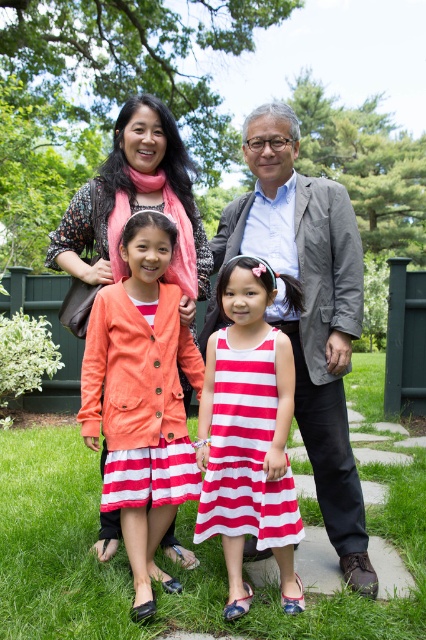
Between matte coral jacket at center and coral fabric jacket at center, which one is positioned higher?

matte coral jacket at center is higher up.

Can you confirm if matte coral jacket at center is smaller than coral fabric jacket at center?

Actually, matte coral jacket at center might be larger than coral fabric jacket at center.

Who is more distant from viewer, (256, 157) or (172, 476)?

The point (256, 157) is behind.

The height and width of the screenshot is (640, 426). Find the location of `matte coral jacket at center`. matte coral jacket at center is located at coordinates (308, 310).

Is matte coral jacket at center smaller than striped cotton dress at center?

No, matte coral jacket at center is not smaller than striped cotton dress at center.

This screenshot has height=640, width=426. Describe the element at coordinates (308, 310) in the screenshot. I see `matte coral jacket at center` at that location.

Identify the location of matte coral jacket at center. Image resolution: width=426 pixels, height=640 pixels. (308, 310).

Is green grass at lower center wider than coral fabric jacket at center?

Indeed, green grass at lower center has a greater width compared to coral fabric jacket at center.

Is green grass at lower center above coral fabric jacket at center?

No, green grass at lower center is not above coral fabric jacket at center.

Is point (353, 362) positioned before point (138, 486)?

No, (353, 362) is behind (138, 486).

Locate an element on the screen. This screenshot has height=640, width=426. green grass at lower center is located at coordinates tap(166, 561).